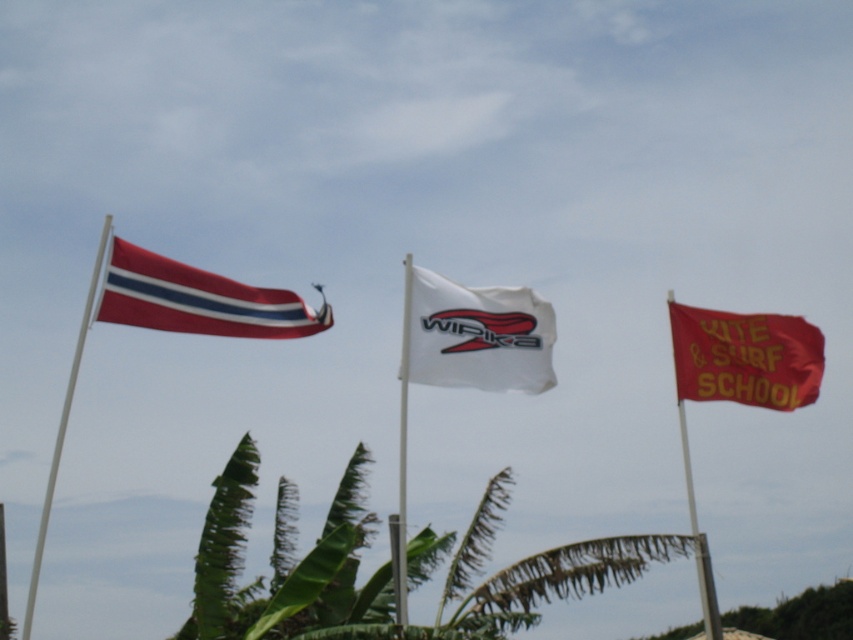
Between green leafy palm tree at lower center and red and white striped flag at left, which one appears on the right side from the viewer's perspective?

green leafy palm tree at lower center is more to the right.

Measure the distance between green leafy palm tree at lower center and red and white striped flag at left.

green leafy palm tree at lower center and red and white striped flag at left are 4.87 meters apart.

Where is `green leafy palm tree at lower center`? Image resolution: width=853 pixels, height=640 pixels. green leafy palm tree at lower center is located at coordinates (288, 564).

What are the coordinates of `green leafy palm tree at lower center` in the screenshot? It's located at (288, 564).

Between point (399, 561) and point (695, 529), which one is positioned in front?

Positioned in front is point (399, 561).

Which is more to the left, white plastic flag pole at center or red fabric flag at right?

From the viewer's perspective, white plastic flag pole at center appears more on the left side.

Find the location of `white plastic flag pole at center`. white plastic flag pole at center is located at coordinates (403, 440).

I want to click on white plastic flag pole at center, so click(x=403, y=440).

Does red and white striped flag at left have a smaller size compared to white plastic flag pole at left?

Correct, red and white striped flag at left occupies less space than white plastic flag pole at left.

Image resolution: width=853 pixels, height=640 pixels. I want to click on red and white striped flag at left, so click(x=196, y=300).

Find the location of a particular element. The width and height of the screenshot is (853, 640). red and white striped flag at left is located at coordinates point(196,300).